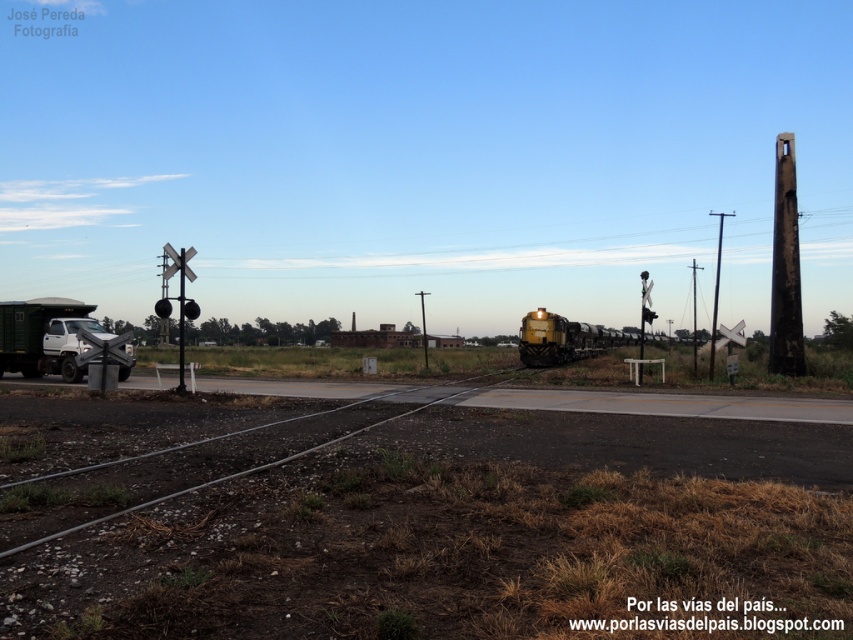
You are standing at the railway crossing and see two points marked on the ground. The first point is at coordinates point [695,304] and the second is at point [421,291]. Which point is closer to you?

The point at [695,304] is closer to you because it is further to the viewer than the point at [421,291].